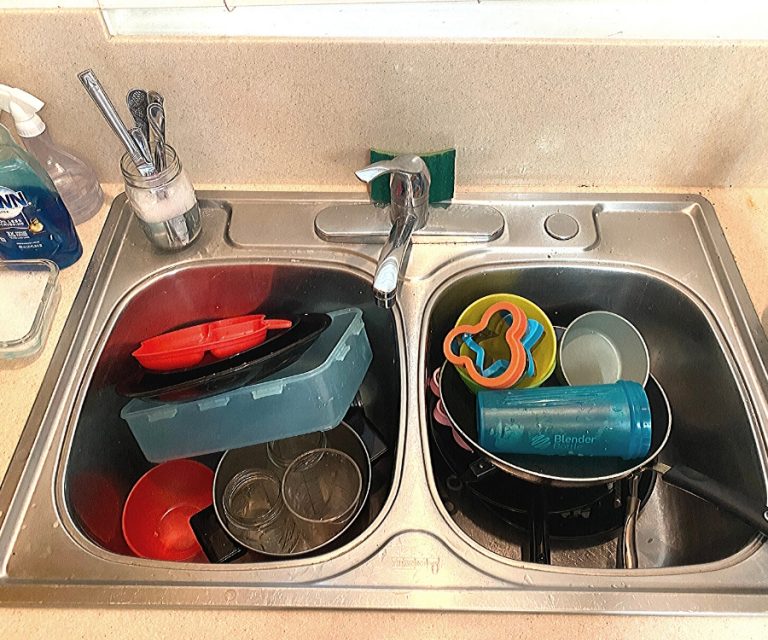
Identify the location of dirty dishes in right side of sink. (525, 360), (543, 416), (558, 492).